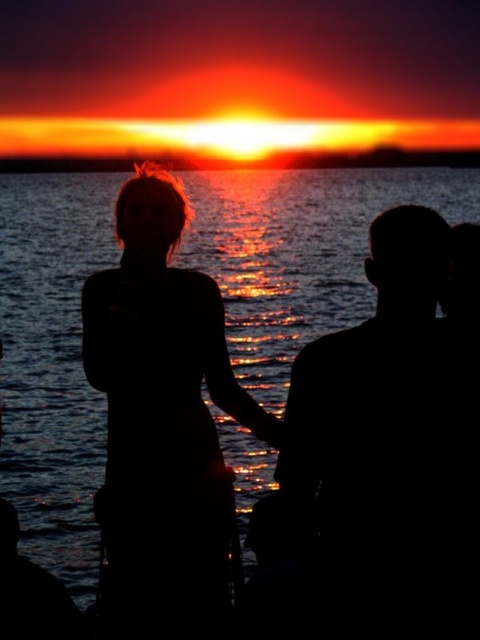
Can you confirm if glistening water at center is positioned to the left of silhouette hair at center?

Correct, you'll find glistening water at center to the left of silhouette hair at center.

Which is below, glistening water at center or silhouette hair at center?

Positioned lower is silhouette hair at center.

The width and height of the screenshot is (480, 640). What do you see at coordinates (52, 364) in the screenshot?
I see `glistening water at center` at bounding box center [52, 364].

Locate an element on the screen. This screenshot has height=640, width=480. glistening water at center is located at coordinates (52, 364).

Is silhouette hair at center positioned in front of sunset sky at center?

Yes, silhouette hair at center is in front of sunset sky at center.

Is point (276, 440) in front of point (311, 160)?

Yes, it is in front of point (311, 160).

The width and height of the screenshot is (480, 640). I want to click on silhouette hair at center, so click(x=163, y=422).

Is glistening water at center bigger than sunset sky at center?

Yes.

Who is taller, glistening water at center or sunset sky at center?

glistening water at center is taller.

What do you see at coordinates (52, 364) in the screenshot? I see `glistening water at center` at bounding box center [52, 364].

At what (x,y) coordinates should I click in order to perform the action: click on glistening water at center. Please return your answer as a coordinate pair (x, y). Looking at the image, I should click on (52, 364).